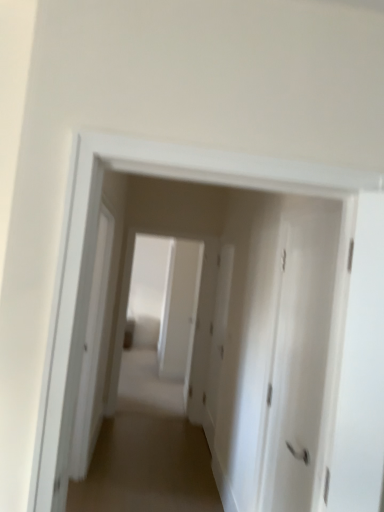
Where is `white matte door at center, which is the 2th door in back-to-front order`? This screenshot has width=384, height=512. white matte door at center, which is the 2th door in back-to-front order is located at coordinates (303, 361).

Does brown carpet at center have a smaller size compared to white matte door at center, placed as the first door when sorted from front to back?

Incorrect, brown carpet at center is not smaller in size than white matte door at center, placed as the first door when sorted from front to back.

Is brown carpet at center further to camera compared to white matte door at center, which is the 2th door in back-to-front order?

Yes, brown carpet at center is behind white matte door at center, which is the 2th door in back-to-front order.

Considering the sizes of brown carpet at center and white matte door at center, which is the 2th door in back-to-front order, in the image, is brown carpet at center wider or thinner than white matte door at center, which is the 2th door in back-to-front order,?

Considering their sizes, brown carpet at center looks broader than white matte door at center, which is the 2th door in back-to-front order.

From a real-world perspective, is brown carpet at center under white matte door at center, placed as the first door when sorted from front to back?

Yes.

From the image's perspective, would you say white matte door at center, placed as the first door when sorted from front to back, is positioned over brown carpet at center?

Correct, white matte door at center, placed as the first door when sorted from front to back, appears higher than brown carpet at center in the image.

Which object is further away from the camera taking this photo, white matte door at center, which is the 2th door in back-to-front order, or brown carpet at center?

brown carpet at center is more distant.

Can we say white matte door at center, which is the 2th door in back-to-front order, lies outside brown carpet at center?

white matte door at center, which is the 2th door in back-to-front order, lies outside brown carpet at center's area.

Is the surface of white matte door at center, placed as the first door when sorted from front to back, in direct contact with brown carpet at center?

white matte door at center, placed as the first door when sorted from front to back, and brown carpet at center are clearly separated.

Is brown carpet at center beside white matte door at center, placed as the first door when sorted from back to front?

There is a gap between brown carpet at center and white matte door at center, placed as the first door when sorted from back to front.

Does point (136, 488) come in front of point (211, 401)?

That is True.

Is brown carpet at center not inside white matte door at center, placed as the first door when sorted from back to front?

brown carpet at center lies outside white matte door at center, placed as the first door when sorted from back to front,'s area.

How different are the orientations of brown carpet at center and white matte door at center, placed as the first door when sorted from back to front, in degrees?

They differ by 89.3 degrees in their facing directions.

Who is more distant, white matte door at center, placed as the first door when sorted from back to front, or white matte door at center, placed as the first door when sorted from front to back?

white matte door at center, placed as the first door when sorted from back to front, is behind.

From a real-world perspective, is white matte door at center, placed as the first door when sorted from back to front, above or below white matte door at center, which is the 2th door in back-to-front order?

white matte door at center, placed as the first door when sorted from back to front, is situated lower than white matte door at center, which is the 2th door in back-to-front order, in the real world.

You are a GUI agent. You are given a task and a screenshot of the screen. Output one action in this format:
    pyautogui.click(x=<x>, y=<y>)
    Task: Click on the door behind the white matte door at center, placed as the first door when sorted from front to back
    This screenshot has width=384, height=512.
    Given the screenshot: What is the action you would take?
    pyautogui.click(x=218, y=335)

Does white matte door at center, the second door when ordered from front to back, have a greater width compared to white matte door at center, placed as the first door when sorted from front to back?

Incorrect, the width of white matte door at center, the second door when ordered from front to back, does not surpass that of white matte door at center, placed as the first door when sorted from front to back.

Is white matte door at center, which is the 2th door in back-to-front order, inside the boundaries of white matte door at center, placed as the first door when sorted from back to front, or outside?

white matte door at center, which is the 2th door in back-to-front order, exists outside the volume of white matte door at center, placed as the first door when sorted from back to front.

Is white matte door at center, which is the 2th door in back-to-front order, aimed at white matte door at center, placed as the first door when sorted from back to front?

No.

How far apart are white matte door at center, placed as the first door when sorted from front to back, and white matte door at center, placed as the first door when sorted from back to front?

white matte door at center, placed as the first door when sorted from front to back, and white matte door at center, placed as the first door when sorted from back to front, are 1.91 meters apart from each other.

Is white matte door at center, placed as the first door when sorted from front to back, beside white matte door at center, placed as the first door when sorted from back to front?

No, white matte door at center, placed as the first door when sorted from front to back, is not making contact with white matte door at center, placed as the first door when sorted from back to front.

Are white matte door at center, the second door when ordered from front to back, and brown carpet at center far apart?

No, white matte door at center, the second door when ordered from front to back, is not far from brown carpet at center.

Considering the sizes of objects white matte door at center, the second door when ordered from front to back, and brown carpet at center in the image provided, who is taller, white matte door at center, the second door when ordered from front to back, or brown carpet at center?

Standing taller between the two is white matte door at center, the second door when ordered from front to back.

Is white matte door at center, the second door when ordered from front to back, closer to camera compared to brown carpet at center?

That is False.

Image resolution: width=384 pixels, height=512 pixels. What are the coordinates of `door that is the 1st object above the brown carpet at center (from a real-world perspective)` in the screenshot? It's located at (218, 335).

Locate an element on the screen. door in front of the brown carpet at center is located at coordinates (303, 361).

I want to click on the 2nd door positioned above the brown carpet at center (from the image's perspective), so click(303, 361).

When comparing their distances from white matte door at center, which is the 2th door in back-to-front order, does white matte door at center, the second door when ordered from front to back, or brown carpet at center seem closer?

brown carpet at center is closer to white matte door at center, which is the 2th door in back-to-front order.

Based on their spatial positions, is white matte door at center, placed as the first door when sorted from back to front, or white matte door at center, placed as the first door when sorted from front to back, further from brown carpet at center?

white matte door at center, placed as the first door when sorted from front to back, is further to brown carpet at center.

From the image, which object appears to be nearer to white matte door at center, placed as the first door when sorted from front to back, brown carpet at center or white matte door at center, placed as the first door when sorted from back to front?

Among the two, brown carpet at center is located nearer to white matte door at center, placed as the first door when sorted from front to back.

Looking at the image, which one is located closer to white matte door at center, placed as the first door when sorted from back to front, brown carpet at center or white matte door at center, placed as the first door when sorted from front to back?

Result: Based on the image, brown carpet at center appears to be nearer to white matte door at center, placed as the first door when sorted from back to front.

Estimate the real-world distances between objects in this image. Which object is closer to brown carpet at center, white matte door at center, which is the 2th door in back-to-front order, or white matte door at center, placed as the first door when sorted from back to front?

white matte door at center, placed as the first door when sorted from back to front, is closer to brown carpet at center.

Consider the image. When comparing their distances from white matte door at center, placed as the first door when sorted from back to front, does white matte door at center, which is the 2th door in back-to-front order, or brown carpet at center seem further?

The object further to white matte door at center, placed as the first door when sorted from back to front, is white matte door at center, which is the 2th door in back-to-front order.

What are the coordinates of `alley positioned between white matte door at center, placed as the first door when sorted from front to back, and white matte door at center, placed as the first door when sorted from back to front, from near to far` in the screenshot? It's located at (147, 450).